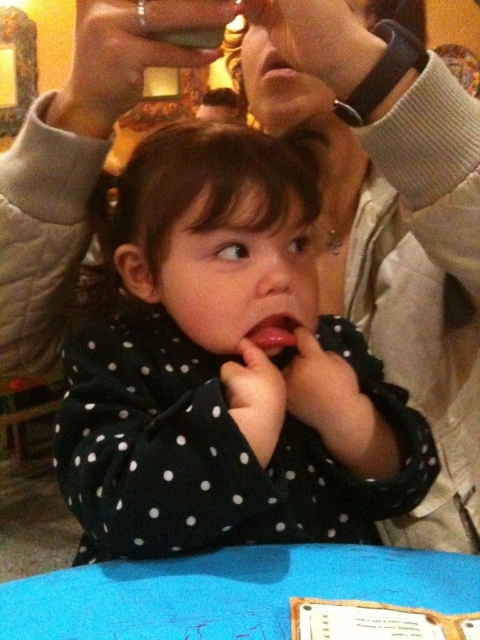
Does point (404, 452) come farther from viewer compared to point (82, 8)?

Yes.

Does black dotted shirt at center appear on the right side of matte plastic cup at upper center?

Correct, you'll find black dotted shirt at center to the right of matte plastic cup at upper center.

Where is `black dotted shirt at center`? This screenshot has width=480, height=640. black dotted shirt at center is located at coordinates (228, 369).

Does blue fabric table at lower center have a lesser height compared to matte plastic cup at upper center?

Correct, blue fabric table at lower center is not as tall as matte plastic cup at upper center.

Between point (311, 572) and point (124, 88), which one is positioned behind?

Point (124, 88)

Find the location of `blue fabric table at lower center`. blue fabric table at lower center is located at coordinates (228, 592).

Between point (311, 173) and point (294, 580), which one is positioned in front?

Point (294, 580) is in front.

Between point (176, 333) and point (382, 554), which one is positioned behind?

The point (176, 333) is more distant.

Locate an element on the screen. black dotted shirt at center is located at coordinates (228, 369).